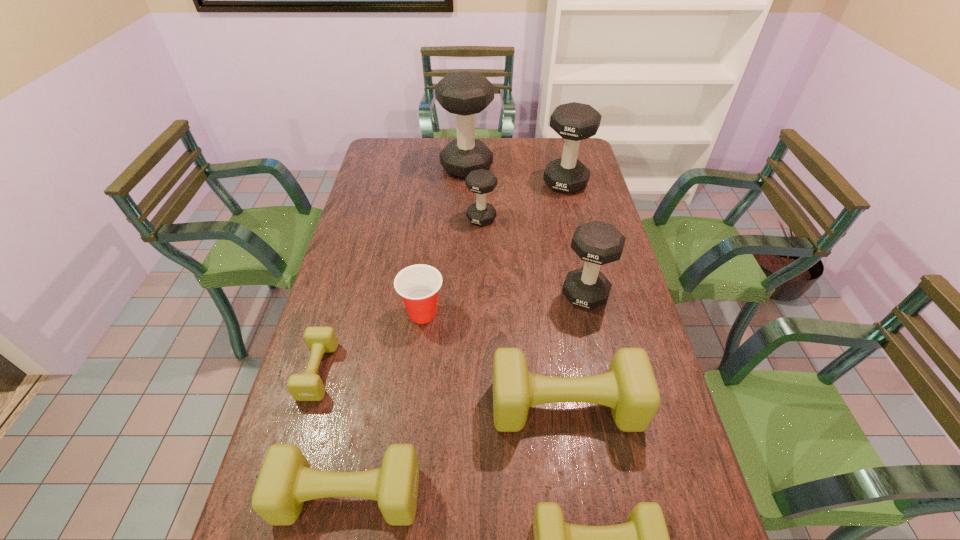
Find the location of `the biggest gray dumbbell`. the biggest gray dumbbell is located at coordinates (464, 93).

You are a GUI agent. You are given a task and a screenshot of the screen. Output one action in this format:
    pyautogui.click(x=<x>, y=<y>)
    Task: Click on the tallest dumbbell
    This screenshot has width=960, height=540.
    Given the screenshot: What is the action you would take?
    pyautogui.click(x=464, y=93)

I want to click on the seventh shortest dumbbell, so click(573, 121).

Find the location of a particular element. the third smallest gray dumbbell is located at coordinates (573, 121).

The width and height of the screenshot is (960, 540). I want to click on the nearest gray dumbbell, so click(597, 243).

Where is `the third tallest object`? The height and width of the screenshot is (540, 960). the third tallest object is located at coordinates (597, 243).

Locate an element on the screen. The width and height of the screenshot is (960, 540). the sixth nearest dumbbell is located at coordinates (480, 181).

Locate an element on the screen. This screenshot has width=960, height=540. the smallest gray dumbbell is located at coordinates (480, 181).

This screenshot has height=540, width=960. Identify the location of the fifth tallest dumbbell. (629, 388).

At what (x,y) coordinates should I click in order to perform the action: click on red cup. Please return your answer as a coordinate pair (x, y). Looking at the image, I should click on (418, 285).